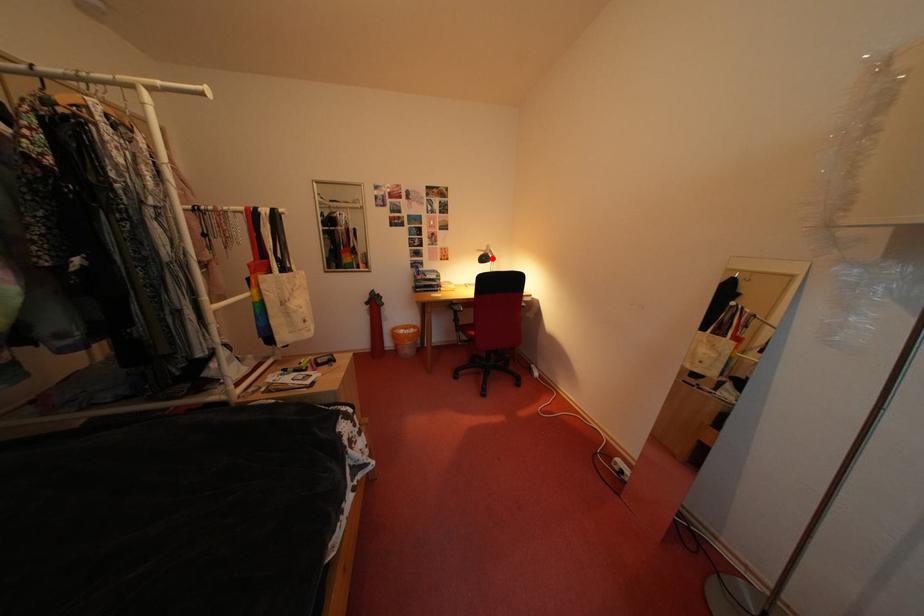
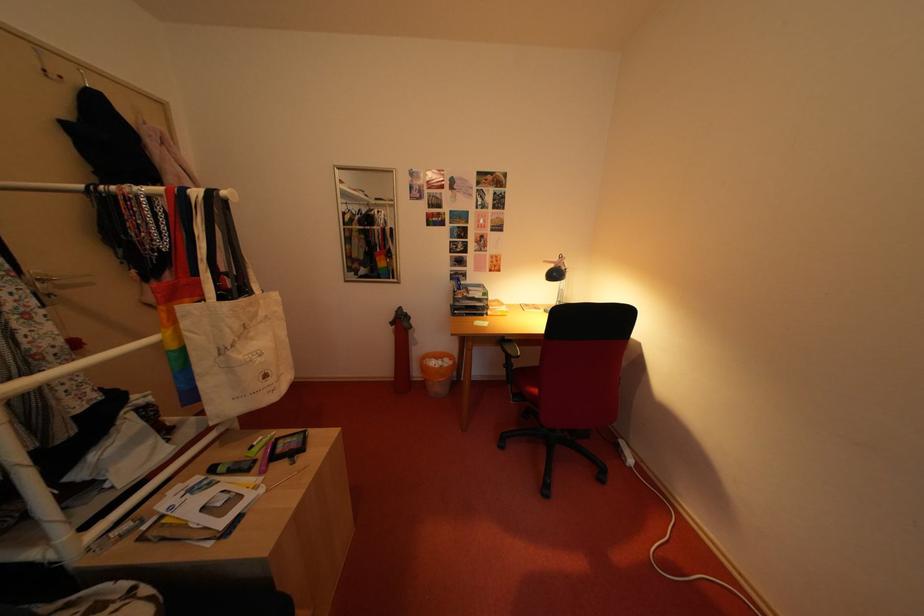
Question: I am providing you with two images of the same scene from different viewpoints. A red point is shown in image1. For the corresponding object point in image2, is it positioned nearer or farther from the camera?

Choices:
 (A) Nearer
 (B) Farther

Answer: (B)